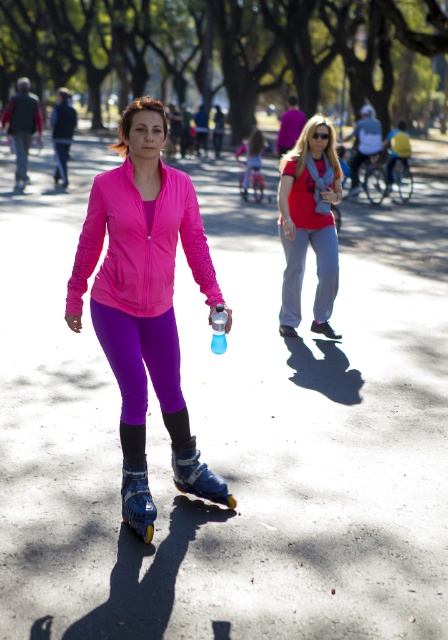
Is pink matte jacket at center wider than blue plastic roller skate at lower center?

Yes, pink matte jacket at center is wider than blue plastic roller skate at lower center.

Who is more forward, (176, 456) or (132, 483)?

Point (132, 483) is more forward.

At what (x,y) coordinates should I click in order to perform the action: click on pink matte jacket at center. Please return your answer as a coordinate pair (x, y). Looking at the image, I should click on (145, 288).

Where is `pink matte jacket at center`? pink matte jacket at center is located at coordinates (145, 288).

Is pink zip-up jacket at center thinner than purple matte leggings at center?

In fact, pink zip-up jacket at center might be wider than purple matte leggings at center.

Can you confirm if pink zip-up jacket at center is wider than purple matte leggings at center?

Yes, pink zip-up jacket at center is wider than purple matte leggings at center.

Is point (87, 260) farther from camera compared to point (176, 390)?

That is False.

Where is `pink zip-up jacket at center`? Image resolution: width=448 pixels, height=640 pixels. pink zip-up jacket at center is located at coordinates (139, 244).

How distant is pink matte jacket at center from purple matte leggings at center?

6.46 inches

Does pink matte jacket at center lie in front of purple matte leggings at center?

That is True.

Where is `pink matte jacket at center`? pink matte jacket at center is located at coordinates (145, 288).

Image resolution: width=448 pixels, height=640 pixels. What are the coordinates of `pink matte jacket at center` in the screenshot? It's located at (145, 288).